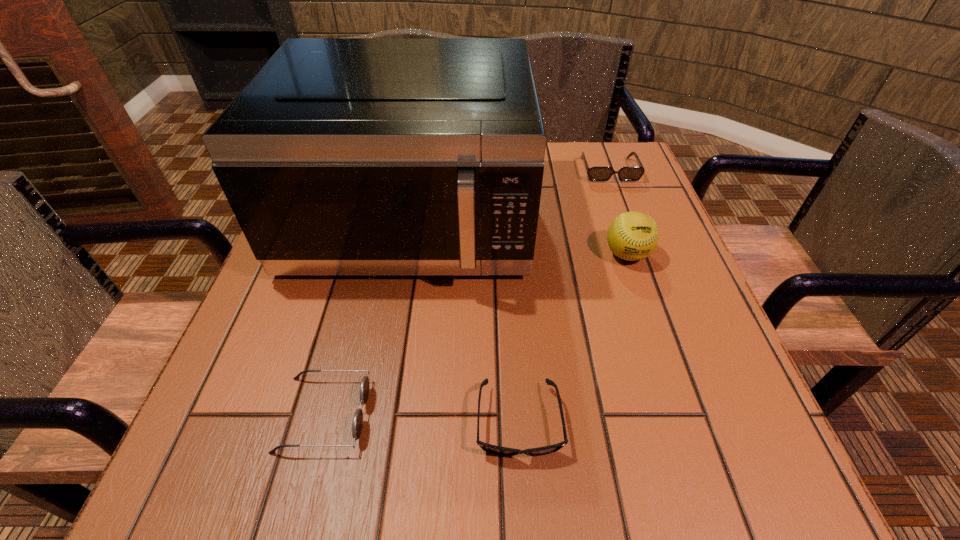
Identify the location of the tallest object. (342, 156).

Find the location of a particular element. the second tallest object is located at coordinates (632, 236).

This screenshot has height=540, width=960. I want to click on the farthest sunglasses, so click(594, 173).

The image size is (960, 540). In order to click on the leftmost sunglasses in this screenshot , I will do `click(357, 425)`.

What are the coordinates of `the second sunglasses from left to right` in the screenshot? It's located at (493, 449).

The height and width of the screenshot is (540, 960). I want to click on vacant space located 0.210m on the front-facing side of the tallest object, so click(379, 401).

Locate an element on the screen. The width and height of the screenshot is (960, 540). free space located on the logo side of the softball is located at coordinates tap(684, 423).

Locate an element on the screen. The width and height of the screenshot is (960, 540). free space located 0.380m on the front-facing side of the rightmost sunglasses is located at coordinates (657, 300).

The width and height of the screenshot is (960, 540). Find the location of `free space located 0.370m on the front-facing side of the leftmost sunglasses`. free space located 0.370m on the front-facing side of the leftmost sunglasses is located at coordinates (611, 414).

I want to click on microwave_oven that is at the far edge, so click(x=342, y=156).